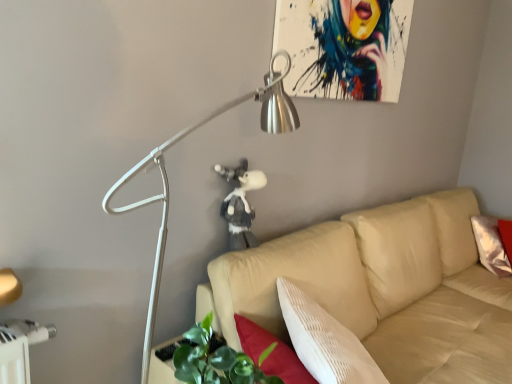
Question: Is fluffy gray plush at center not inside beige fabric couch at center?

Choices:
 (A) no
 (B) yes

Answer: (B)

Question: Can you confirm if fluffy gray plush at center is taller than beige fabric couch at center?

Choices:
 (A) yes
 (B) no

Answer: (B)

Question: Can you confirm if fluffy gray plush at center is smaller than beige fabric couch at center?

Choices:
 (A) yes
 (B) no

Answer: (A)

Question: From the image's perspective, is fluffy gray plush at center below beige fabric couch at center?

Choices:
 (A) no
 (B) yes

Answer: (A)

Question: Is beige fabric couch at center at the back of fluffy gray plush at center?

Choices:
 (A) no
 (B) yes

Answer: (A)

Question: From the image's perspective, is beige fabric couch at center positioned above or below metallic silver lamp at upper left?

Choices:
 (A) below
 (B) above

Answer: (A)

Question: Considering the positions of beige fabric couch at center and metallic silver lamp at upper left in the image, is beige fabric couch at center taller or shorter than metallic silver lamp at upper left?

Choices:
 (A) tall
 (B) short

Answer: (B)

Question: Considering the positions of beige fabric couch at center and metallic silver lamp at upper left in the image, is beige fabric couch at center bigger or smaller than metallic silver lamp at upper left?

Choices:
 (A) small
 (B) big

Answer: (B)

Question: In terms of width, does beige fabric couch at center look wider or thinner when compared to metallic silver lamp at upper left?

Choices:
 (A) thin
 (B) wide

Answer: (B)

Question: In terms of height, does metallic silver lamp at upper left look taller or shorter compared to fluffy gray plush at center?

Choices:
 (A) short
 (B) tall

Answer: (B)

Question: Considering the positions of metallic silver lamp at upper left and fluffy gray plush at center in the image, is metallic silver lamp at upper left wider or thinner than fluffy gray plush at center?

Choices:
 (A) thin
 (B) wide

Answer: (B)

Question: Does point (109, 208) appear closer or farther from the camera than point (234, 185)?

Choices:
 (A) closer
 (B) farther

Answer: (A)

Question: In the image, is metallic silver lamp at upper left positioned in front of or behind fluffy gray plush at center?

Choices:
 (A) front
 (B) behind

Answer: (A)

Question: Choose the correct answer: Is fluffy gray plush at center inside beige fabric couch at center or outside it?

Choices:
 (A) outside
 (B) inside

Answer: (A)

Question: Considering the positions of fluffy gray plush at center and beige fabric couch at center in the image, is fluffy gray plush at center taller or shorter than beige fabric couch at center?

Choices:
 (A) tall
 (B) short

Answer: (B)